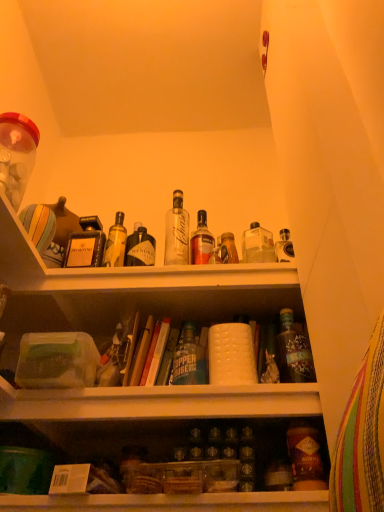
What is the approximate width of translucent glass bottle at center right, positioned as the 1th bottle in right-to-left order?

translucent glass bottle at center right, positioned as the 1th bottle in right-to-left order, is 4.52 inches wide.

You are a GUI agent. You are given a task and a screenshot of the screen. Output one action in this format:
    pyautogui.click(x=<x>, y=<y>)
    Task: Click on the green glass bottle at center, the 2th bottle when ordered from left to right
    Image resolution: width=384 pixels, height=512 pixels.
    Given the screenshot: What is the action you would take?
    pyautogui.click(x=189, y=359)

At what (x,y) coordinates should I click in order to perform the action: click on matte brown bottle at lower right, arranged as the fourth bottle when viewed from the left. Please return your answer as a coordinate pair (x, y). The width and height of the screenshot is (384, 512). Looking at the image, I should click on (305, 458).

Identify the location of hardcover book at center, which appears as the 1th book when viewed from the left. This screenshot has height=512, width=384. (131, 350).

What is the approximate width of clear glass bottle at center, placed as the first bottle when sorted from left to right?

It is 10.74 centimeters.

In order to click on translucent glass bottle at center right, the fifth bottle positioned from the left in this screenshot , I will do `click(294, 351)`.

Find the location of a particular element. Image resolution: width=384 pixels, height=512 pixels. the 1st bottle positioned above the hardcover book at center, which appears as the 1th book when viewed from the left (from the image's perspective) is located at coordinates (294, 351).

Is hardcover book at center, the 2th book viewed from the right, touching translucent glass bottle at center right, positioned as the 1th bottle in right-to-left order?

hardcover book at center, the 2th book viewed from the right, is not next to translucent glass bottle at center right, positioned as the 1th bottle in right-to-left order, and they're not touching.

Which object is positioned more to the right, hardcover book at center, which appears as the 1th book when viewed from the left, or translucent glass bottle at center right, the fifth bottle positioned from the left?

translucent glass bottle at center right, the fifth bottle positioned from the left.

Does hardcover book at center, which appears as the 1th book when viewed from the left, have a greater height compared to translucent glass bottle at center right, the fifth bottle positioned from the left?

Yes.

Are green glass bottle at center, the 4th bottle when ordered from right to left, and hardcover book at center, which appears as the 1th book when viewed from the left, beside each other?

No, green glass bottle at center, the 4th bottle when ordered from right to left, is not touching hardcover book at center, which appears as the 1th book when viewed from the left.

Relative to hardcover book at center, which appears as the 1th book when viewed from the left, is green glass bottle at center, the 2th bottle when ordered from left to right, in front or behind?

green glass bottle at center, the 2th bottle when ordered from left to right, is positioned farther from the viewer than hardcover book at center, which appears as the 1th book when viewed from the left.

From a real-world perspective, which is physically below, green glass bottle at center, the 4th bottle when ordered from right to left, or hardcover book at center, the 2th book viewed from the right?

green glass bottle at center, the 4th bottle when ordered from right to left, is physically lower.

From the image's perspective, which one is positioned lower, green glass bottle at center, the 4th bottle when ordered from right to left, or hardcover book at center, which appears as the 1th book when viewed from the left?

green glass bottle at center, the 4th bottle when ordered from right to left, from the image's perspective.

Looking at this image, is green glass bottle at center, the 4th bottle when ordered from right to left, to the left or to the right of matte brown bottle at lower right, acting as the 2th bottle starting from the right, in the image?

green glass bottle at center, the 4th bottle when ordered from right to left, is positioned on matte brown bottle at lower right, acting as the 2th bottle starting from the right,'s left side.

Would you say green glass bottle at center, the 4th bottle when ordered from right to left, is inside or outside matte brown bottle at lower right, acting as the 2th bottle starting from the right?

green glass bottle at center, the 4th bottle when ordered from right to left, cannot be found inside matte brown bottle at lower right, acting as the 2th bottle starting from the right.

Considering the sizes of objects green glass bottle at center, the 2th bottle when ordered from left to right, and matte brown bottle at lower right, acting as the 2th bottle starting from the right, in the image provided, who is wider, green glass bottle at center, the 2th bottle when ordered from left to right, or matte brown bottle at lower right, acting as the 2th bottle starting from the right,?

Wider between the two is green glass bottle at center, the 2th bottle when ordered from left to right.

Is the position of matte brown bottle at lower right, arranged as the fourth bottle when viewed from the left, more distant than that of hardcover book at center, which appears as the 1th book when viewed from the left?

That is False.

Can you confirm if matte brown bottle at lower right, arranged as the fourth bottle when viewed from the left, is wider than hardcover book at center, the 2th book viewed from the right?

In fact, matte brown bottle at lower right, arranged as the fourth bottle when viewed from the left, might be narrower than hardcover book at center, the 2th book viewed from the right.

Is point (305, 452) closer to camera compared to point (124, 386)?

Yes.

Is matte brown bottle at lower right, arranged as the fourth bottle when viewed from the left, smaller than hardcover book at center, the 2th book viewed from the right?

Yes, matte brown bottle at lower right, arranged as the fourth bottle when viewed from the left, is smaller than hardcover book at center, the 2th book viewed from the right.

Is translucent glass bottle at center, the third bottle in the left-to-right sequence, touching green glass bottle at center, the 2th bottle when ordered from left to right?

No, translucent glass bottle at center, the third bottle in the left-to-right sequence, is not with green glass bottle at center, the 2th bottle when ordered from left to right.

Which is in front, point (227, 254) or point (182, 377)?

The point (182, 377) is in front.

Is translucent glass bottle at center, the 3th bottle when ordered from right to left, looking in the opposite direction of green glass bottle at center, the 2th bottle when ordered from left to right?

No, translucent glass bottle at center, the 3th bottle when ordered from right to left,'s orientation is not away from green glass bottle at center, the 2th bottle when ordered from left to right.

Looking at this image, can you confirm if translucent glass bottle at center right, the fifth bottle positioned from the left, is positioned to the left of matte brown bottle at lower right, arranged as the fourth bottle when viewed from the left?

In fact, translucent glass bottle at center right, the fifth bottle positioned from the left, is to the right of matte brown bottle at lower right, arranged as the fourth bottle when viewed from the left.

Would you say matte brown bottle at lower right, acting as the 2th bottle starting from the right, is part of translucent glass bottle at center right, the fifth bottle positioned from the left,'s contents?

No, matte brown bottle at lower right, acting as the 2th bottle starting from the right, is not a part of translucent glass bottle at center right, the fifth bottle positioned from the left.

Identify the location of bottle that is the 2nd one above the matte brown bottle at lower right, acting as the 2th bottle starting from the right (from a real-world perspective). The height and width of the screenshot is (512, 384). (294, 351).

Can you confirm if translucent glass bottle at center right, positioned as the 1th bottle in right-to-left order, is wider than matte brown bottle at lower right, arranged as the fourth bottle when viewed from the left?

Correct, the width of translucent glass bottle at center right, positioned as the 1th bottle in right-to-left order, exceeds that of matte brown bottle at lower right, arranged as the fourth bottle when viewed from the left.

Between hardcover book at center, the 1th book viewed from the right, and translucent glass bottle at center, the 3th bottle when ordered from right to left, which one has larger width?

hardcover book at center, the 1th book viewed from the right, is wider.

Is hardcover book at center, positioned as the 2th book in left-to-right order, smaller than translucent glass bottle at center, the 3th bottle when ordered from right to left?

No, hardcover book at center, positioned as the 2th book in left-to-right order, is not smaller than translucent glass bottle at center, the 3th bottle when ordered from right to left.

Based on the photo, from the image's perspective, between hardcover book at center, the 1th book viewed from the right, and translucent glass bottle at center, the third bottle in the left-to-right sequence, which one is located above?

translucent glass bottle at center, the third bottle in the left-to-right sequence, appears higher in the image.

Is point (141, 379) closer or farther from the camera than point (224, 234)?

Point (141, 379) is positioned closer to the camera compared to point (224, 234).

Find the location of `book below the translucent glass bottle at center right, the fifth bottle positioned from the left (from a real-world perspective)`. book below the translucent glass bottle at center right, the fifth bottle positioned from the left (from a real-world perspective) is located at coordinates (131, 350).

There is a hardcover book at center, the 2th book viewed from the right. Where is `the 1st bottle below it (from the image's perspective)`? the 1st bottle below it (from the image's perspective) is located at coordinates (189, 359).

When comparing their distances from green glass bottle at center, the 2th bottle when ordered from left to right, does clear glass bottle at center, placed as the first bottle when sorted from left to right, or hardcover book at center, the 1th book viewed from the right, seem further?

Based on the image, clear glass bottle at center, placed as the first bottle when sorted from left to right, appears to be further to green glass bottle at center, the 2th bottle when ordered from left to right.

Considering their positions, is translucent glass bottle at center right, positioned as the 1th bottle in right-to-left order, positioned further to green glass bottle at center, the 2th bottle when ordered from left to right, than translucent glass bottle at center, the 3th bottle when ordered from right to left?

translucent glass bottle at center, the 3th bottle when ordered from right to left, lies further to green glass bottle at center, the 2th bottle when ordered from left to right, than the other object.

Which object lies nearer to the anchor point matte brown bottle at lower right, acting as the 2th bottle starting from the right, translucent glass bottle at center right, positioned as the 1th bottle in right-to-left order, or translucent glass bottle at center, the third bottle in the left-to-right sequence?

The object closer to matte brown bottle at lower right, acting as the 2th bottle starting from the right, is translucent glass bottle at center right, positioned as the 1th bottle in right-to-left order.

Looking at the image, which one is located closer to hardcover book at center, positioned as the 2th book in left-to-right order, hardcover book at center, which appears as the 1th book when viewed from the left, or matte brown bottle at lower right, arranged as the fourth bottle when viewed from the left?

hardcover book at center, which appears as the 1th book when viewed from the left, is positioned closer to the anchor hardcover book at center, positioned as the 2th book in left-to-right order.

Based on their spatial positions, is translucent glass bottle at center, the 3th bottle when ordered from right to left, or clear glass bottle at center, which ranks as the 5th bottle in right-to-left order, further from hardcover book at center, which appears as the 1th book when viewed from the left?

clear glass bottle at center, which ranks as the 5th bottle in right-to-left order, is further to hardcover book at center, which appears as the 1th book when viewed from the left.

Looking at this image, from the image, which object appears to be nearer to translucent glass bottle at center right, positioned as the 1th bottle in right-to-left order, green glass bottle at center, the 4th bottle when ordered from right to left, or hardcover book at center, the 2th book viewed from the right?

green glass bottle at center, the 4th bottle when ordered from right to left, is positioned closer to the anchor translucent glass bottle at center right, positioned as the 1th bottle in right-to-left order.

Looking at the image, which one is located closer to hardcover book at center, positioned as the 2th book in left-to-right order, matte brown bottle at lower right, arranged as the fourth bottle when viewed from the left, or hardcover book at center, the 2th book viewed from the right?

hardcover book at center, the 2th book viewed from the right, is positioned closer to the anchor hardcover book at center, positioned as the 2th book in left-to-right order.

Considering their positions, is hardcover book at center, the 1th book viewed from the right, positioned further to translucent glass bottle at center, the third bottle in the left-to-right sequence, than clear glass bottle at center, placed as the first bottle when sorted from left to right?

hardcover book at center, the 1th book viewed from the right.

Locate an element on the screen. The width and height of the screenshot is (384, 512). book located between hardcover book at center, which appears as the 1th book when viewed from the left, and green glass bottle at center, the 4th bottle when ordered from right to left, in the left-right direction is located at coordinates (156, 354).

I want to click on book between clear glass bottle at center, which ranks as the 5th bottle in right-to-left order, and hardcover book at center, positioned as the 2th book in left-to-right order, in the vertical direction, so click(131, 350).

At what (x,y) coordinates should I click in order to perform the action: click on bottle between translucent glass bottle at center, the 3th bottle when ordered from right to left, and green glass bottle at center, the 2th bottle when ordered from left to right, in the up-down direction. Please return your answer as a coordinate pair (x, y). Looking at the image, I should click on (294, 351).

Where is `book situated between hardcover book at center, the 2th book viewed from the right, and matte brown bottle at lower right, arranged as the fourth bottle when viewed from the left, from left to right`? This screenshot has width=384, height=512. book situated between hardcover book at center, the 2th book viewed from the right, and matte brown bottle at lower right, arranged as the fourth bottle when viewed from the left, from left to right is located at coordinates (156, 354).